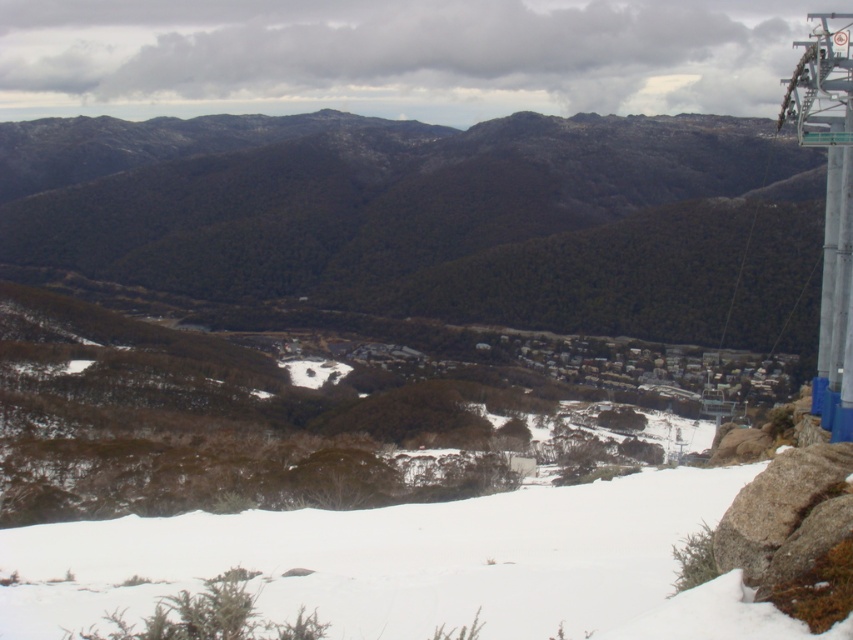
You are a GUI agent. You are given a task and a screenshot of the screen. Output one action in this format:
    pyautogui.click(x=<x>, y=<y>)
    Task: Click on the green matte mountain at center
    Image resolution: width=853 pixels, height=640 pixels.
    Given the screenshot: What is the action you would take?
    pyautogui.click(x=438, y=216)

Does point (53, 176) come behind point (526, 579)?

Yes, it is.

You are a GUI agent. You are given a task and a screenshot of the screen. Output one action in this format:
    pyautogui.click(x=<x>, y=<y>)
    Task: Click on the green matte mountain at center
    
    Given the screenshot: What is the action you would take?
    pyautogui.click(x=438, y=216)